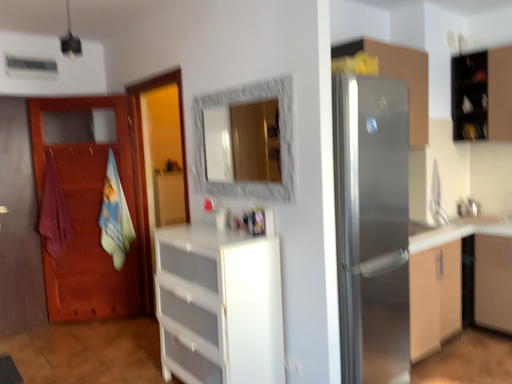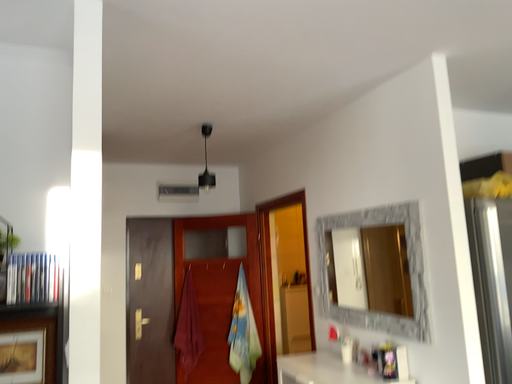
Question: How did the camera likely rotate when shooting the video?

Choices:
 (A) rotated downward
 (B) rotated upward

Answer: (B)